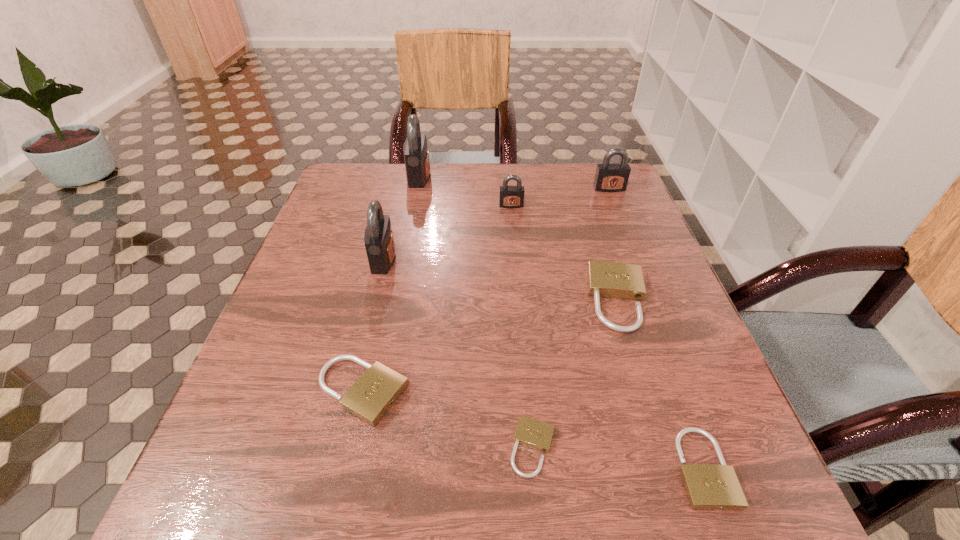
The height and width of the screenshot is (540, 960). Identify the location of vacant space that satisfies the following two spatial constraints: 1. on the back side of the smallest beige padlock; 2. on the front of the seventh shortest padlock near the keyhole. (516, 259).

Where is `free space that satisfies the following two spatial constraints: 1. on the front of the second shortest padlock near the keyhole; 2. on the left side of the fifth shortest object`? The width and height of the screenshot is (960, 540). free space that satisfies the following two spatial constraints: 1. on the front of the second shortest padlock near the keyhole; 2. on the left side of the fifth shortest object is located at coordinates (535, 468).